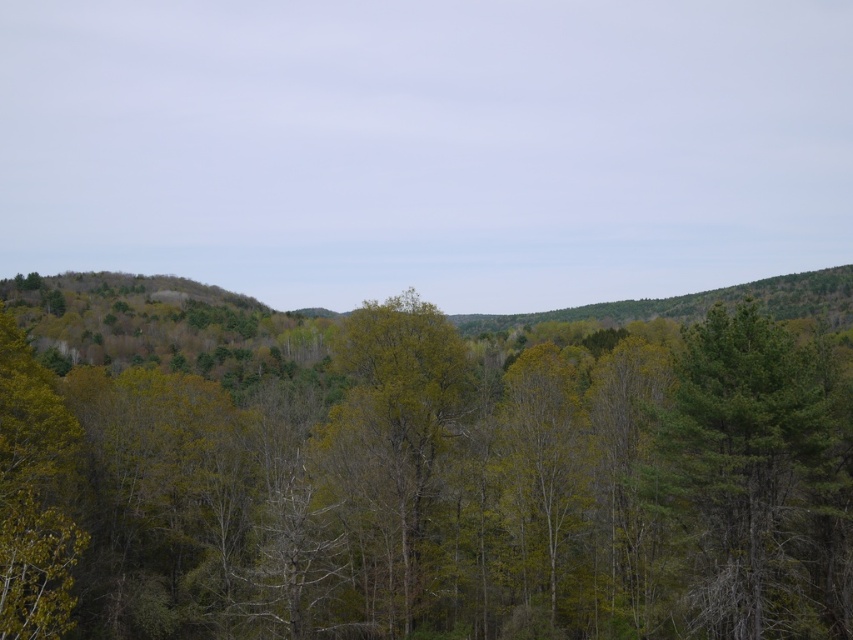
You are a hiker standing at the base of the green matte tree at center and want to reach the green matte tree at right. Which direction should you walk to get there?

A: The green matte tree at center is positioned on the left side of the green matte tree at right, so you should walk to the right to reach the green matte tree at right.

You are planning to plant a new tree in this forest scene. You have two options for placement based on existing trees. The green matte tree at center and the green matte tree at right are both candidates. Which tree has a wider trunk or canopy? Please choose between the two based on their sizes.

The green matte tree at center has a larger width compared to the green matte tree at right, so it has a wider trunk or canopy.

You are a hiker trying to navigate through the forest. You notice two trees, the green matte tree at center and the green matte tree at right. Which tree should you use as a landmark if you want to mark a spot that is closer to the center of the forest?

The green matte tree at center is bigger than the green matte tree at right, so it would be a better landmark for the center of the forest since it is larger and more prominent.